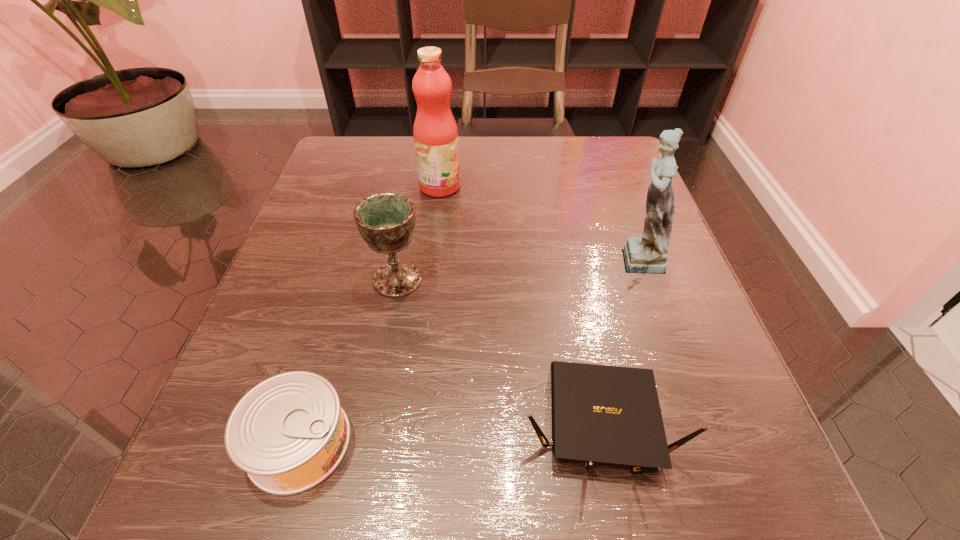
At what (x,y) coordinates should I click in order to perform the action: click on vacant area situated 0.330m on the back of the second shortest object. Please return your answer as a coordinate pair (x, y). This screenshot has height=540, width=960. Looking at the image, I should click on (558, 220).

At what (x,y) coordinates should I click in order to perform the action: click on vacant region located on the right of the shortest object. Please return your answer as a coordinate pair (x, y). This screenshot has height=540, width=960. Looking at the image, I should click on pyautogui.click(x=420, y=442).

The height and width of the screenshot is (540, 960). Find the location of `object situated at the far edge`. object situated at the far edge is located at coordinates click(435, 132).

Identify the location of router present at the near edge. This screenshot has width=960, height=540. (600, 413).

The height and width of the screenshot is (540, 960). I want to click on can positioned at the near edge, so click(x=289, y=433).

Find the location of `object that is positioned at the left edge`. object that is positioned at the left edge is located at coordinates (289, 433).

Locate an element on the screen. The image size is (960, 540). figurine that is at the right edge is located at coordinates (648, 254).

This screenshot has width=960, height=540. Identify the location of router that is at the right edge. (600, 413).

At what (x,y) coordinates should I click in order to perform the action: click on object present at the near left corner. Please return your answer as a coordinate pair (x, y). Looking at the image, I should click on (289, 433).

Image resolution: width=960 pixels, height=540 pixels. Find the location of `object situated at the near right corner`. object situated at the near right corner is located at coordinates (600, 413).